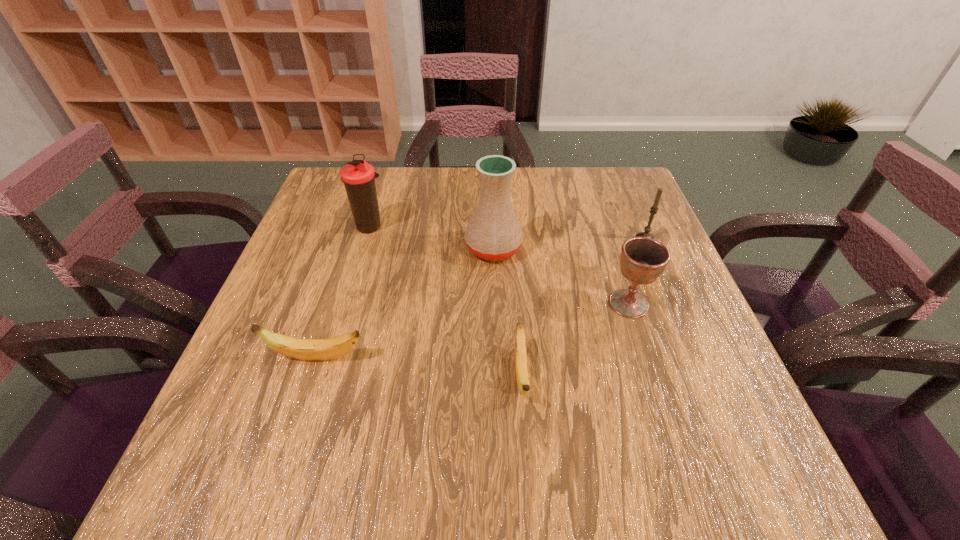
The image size is (960, 540). Identify the location of the left banana. (304, 349).

You are a GUI agent. You are given a task and a screenshot of the screen. Output one action in this format:
    pyautogui.click(x=<x>, y=<y>)
    Task: Click on the taller banana
    
    Given the screenshot: What is the action you would take?
    pyautogui.click(x=304, y=349)

Image resolution: width=960 pixels, height=540 pixels. In order to click on the right banana in this screenshot , I will do `click(522, 376)`.

This screenshot has height=540, width=960. I want to click on the shortest object, so click(522, 376).

Find the location of a particular element. thermos bottle is located at coordinates (358, 176).

You are a GUI agent. You are given a task and a screenshot of the screen. Output one action in this format:
    pyautogui.click(x=<x>, y=<y>)
    Task: Click on the rightmost object
    The width and height of the screenshot is (960, 540).
    Given the screenshot: What is the action you would take?
    pyautogui.click(x=654, y=208)

Locate an element on the screen. The image size is (960, 540). the second object from right to left is located at coordinates (643, 260).

Where is `chalice`? Image resolution: width=960 pixels, height=540 pixels. chalice is located at coordinates (643, 260).

Where is `pottery`? Image resolution: width=960 pixels, height=540 pixels. pottery is located at coordinates (494, 232).

Locate an element on the screen. The width and height of the screenshot is (960, 540). vacant point located 0.090m on the right of the thermos bottle is located at coordinates (423, 226).